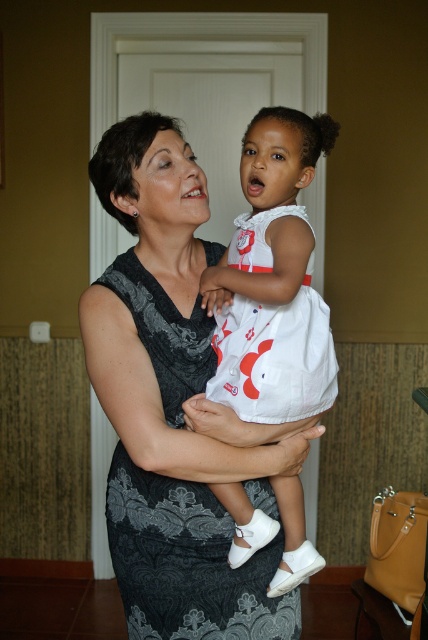
Is white satin dress at center positioned before black lace dress at center?

Yes, white satin dress at center is closer to the viewer.

Can you confirm if white satin dress at center is positioned below black lace dress at center?

Actually, white satin dress at center is above black lace dress at center.

This screenshot has height=640, width=428. Describe the element at coordinates (269, 292) in the screenshot. I see `white satin dress at center` at that location.

Where is `white satin dress at center`? This screenshot has height=640, width=428. white satin dress at center is located at coordinates (269, 292).